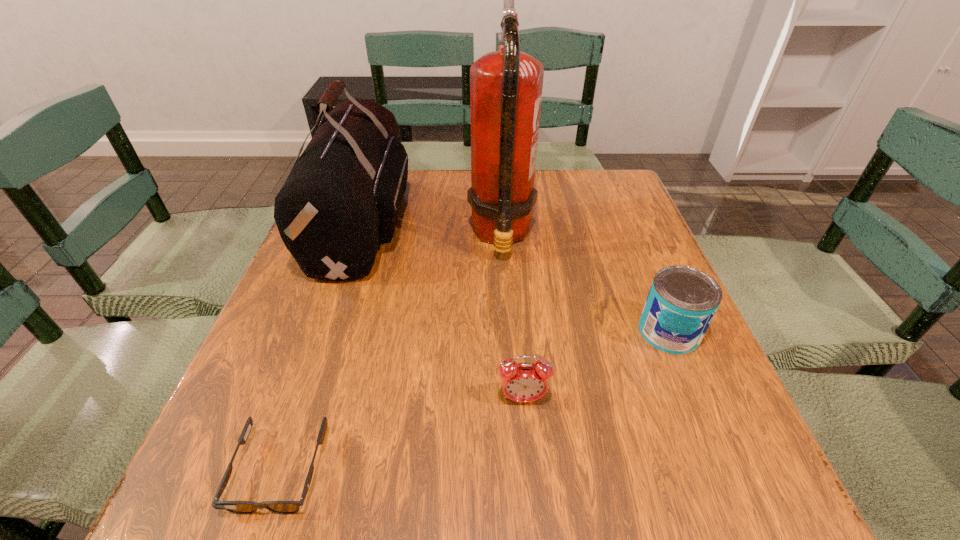
The width and height of the screenshot is (960, 540). In order to click on fire extinguisher in this screenshot , I will do `click(506, 86)`.

Identify the location of duffel bag. (341, 200).

The height and width of the screenshot is (540, 960). What are the coordinates of `can` in the screenshot? It's located at (682, 301).

You are a GUI agent. You are given a task and a screenshot of the screen. Output one action in this format:
    pyautogui.click(x=<x>, y=<y>)
    Task: Click on the third farthest object
    This screenshot has width=960, height=540.
    Given the screenshot: What is the action you would take?
    pyautogui.click(x=682, y=301)

You are a GUI agent. You are given a task and a screenshot of the screen. Output one action in this format:
    pyautogui.click(x=<x>, y=<y>)
    Task: Click on the fourth farthest object
    
    Given the screenshot: What is the action you would take?
    pyautogui.click(x=522, y=382)

Image resolution: width=960 pixels, height=540 pixels. I want to click on the nearest object, so click(x=237, y=507).

Image resolution: width=960 pixels, height=540 pixels. What are the coordinates of `the shortest object` in the screenshot? It's located at (237, 507).

Identify the location of vacant space located 0.370m at the nozzle of the fire extinguisher. (319, 235).

Find the location of a particular element. The width and height of the screenshot is (960, 540). vacant space situated at the nozzle of the fire extinguisher is located at coordinates (343, 235).

This screenshot has width=960, height=540. Find the location of `free space located 0.300m at the nozzle of the fire extinguisher`. free space located 0.300m at the nozzle of the fire extinguisher is located at coordinates [348, 235].